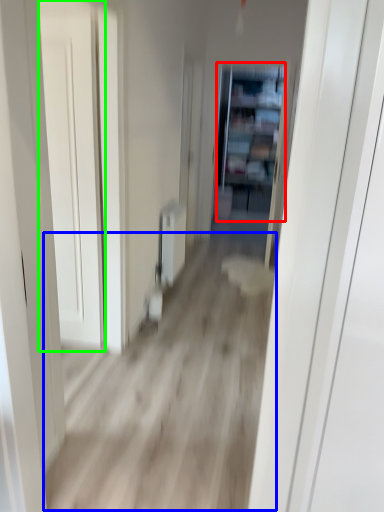
Question: Which object is positioned farthest from bookshelf (highlighted by a red box)? Select from corridor (highlighted by a blue box) and door (highlighted by a green box).

Choices:
 (A) corridor
 (B) door

Answer: (B)